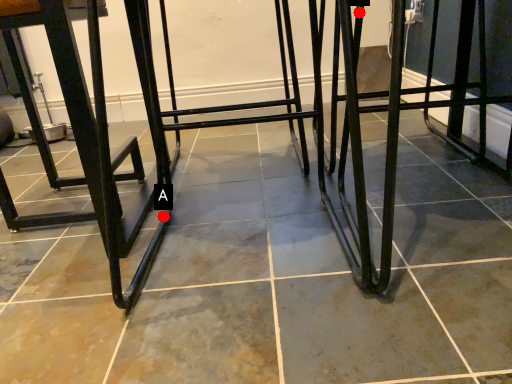
Question: Two points are circled on the image, labeled by A and B beside each circle. Which point is closer to the camera taking this photo?

Choices:
 (A) A is closer
 (B) B is closer

Answer: (B)